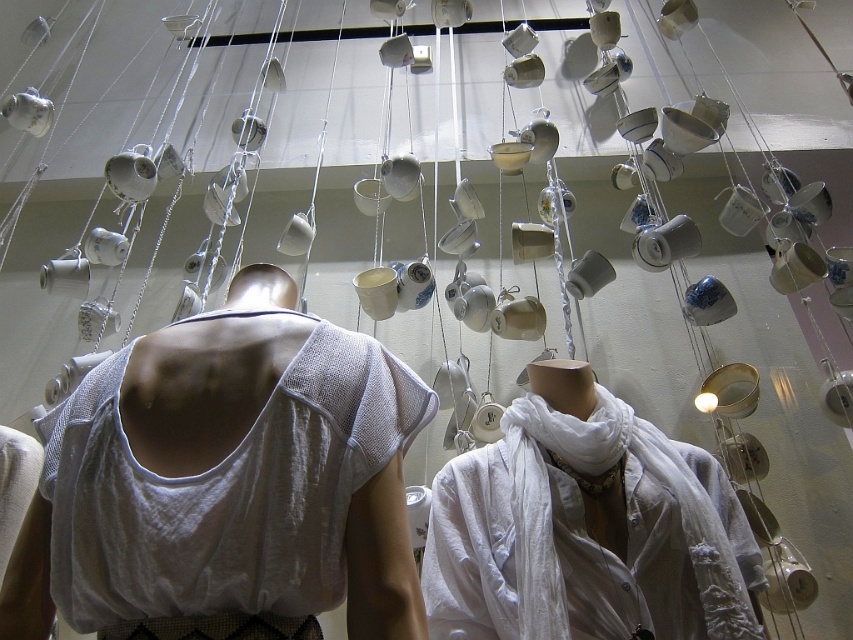
Question: Is white mesh tank top at center wider than white cotton scarf at center?

Choices:
 (A) no
 (B) yes

Answer: (A)

Question: Can you confirm if white mesh tank top at center is positioned to the right of white cotton scarf at center?

Choices:
 (A) yes
 (B) no

Answer: (B)

Question: Does white mesh tank top at center appear under white cotton scarf at center?

Choices:
 (A) no
 (B) yes

Answer: (A)

Question: Which object appears closest to the camera in this image?

Choices:
 (A) white cotton scarf at center
 (B) white mesh tank top at center

Answer: (B)

Question: Among these objects, which one is farthest from the camera?

Choices:
 (A) white cotton scarf at center
 (B) white mesh tank top at center

Answer: (A)